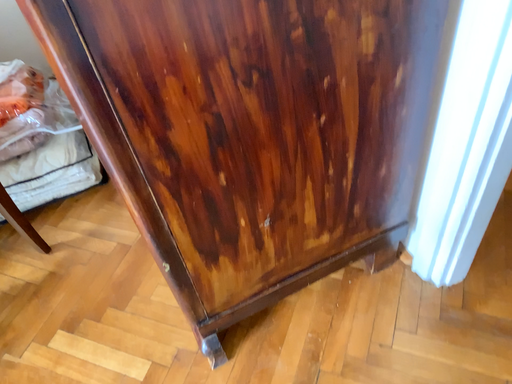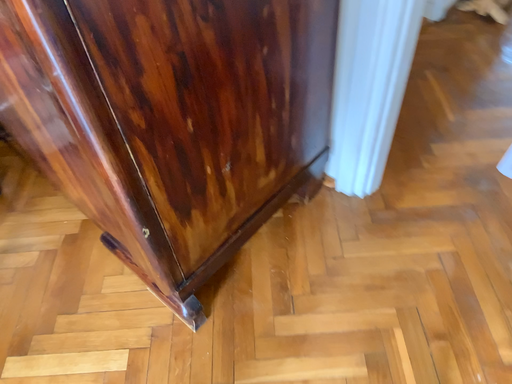
Question: Which way did the camera rotate in the video?

Choices:
 (A) rotated right
 (B) rotated left

Answer: (A)